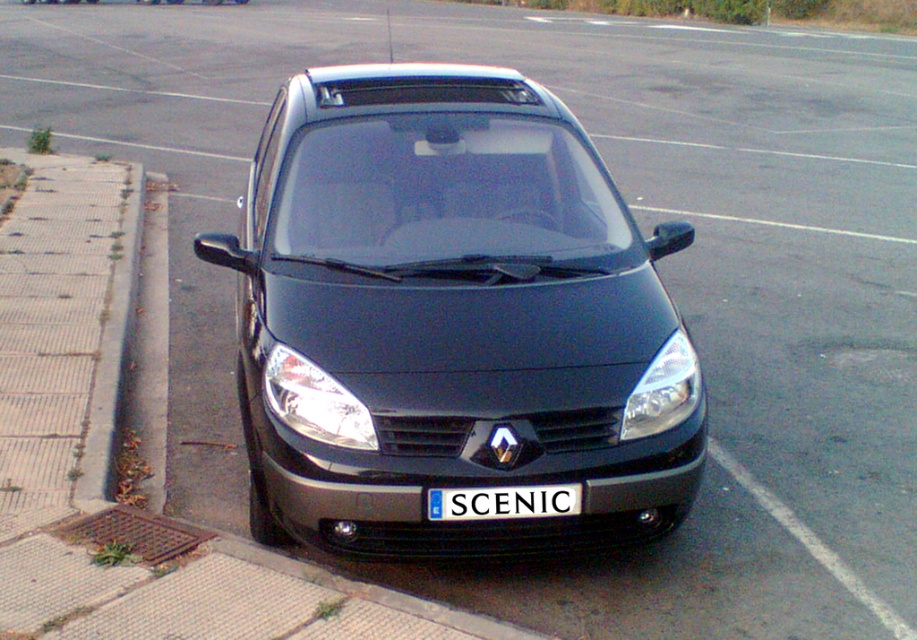
Does matte black car at center have a greater width compared to white plastic license plate at center?

Yes, matte black car at center is wider than white plastic license plate at center.

Is matte black car at center to the right of white plastic license plate at center from the viewer's perspective?

Incorrect, matte black car at center is not on the right side of white plastic license plate at center.

Between point (275, 218) and point (517, 500), which one is positioned behind?

The point (275, 218) is more distant.

Where is `matte black car at center`? The width and height of the screenshot is (917, 640). matte black car at center is located at coordinates (451, 321).